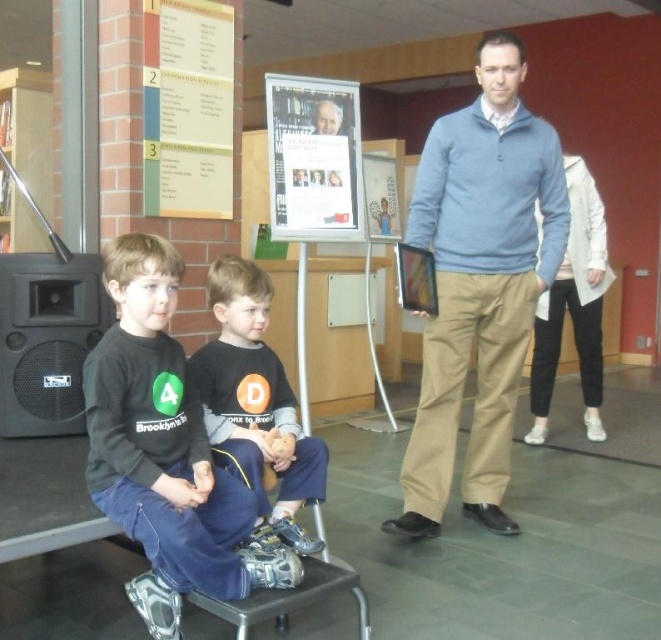
You are a delivery person who needs to place a package between the blue sweater at center and the black matte speaker at left. The package requires a space of 4 feet. Can you fit the package between them?

The blue sweater at center and the black matte speaker at left are 4.15 feet apart, so yes, the package requiring 4 feet of space can fit between them since the distance is sufficient.

You are a delivery person who needs to place a package between the black cotton shirt at center and the black matte speaker at left. The package is 20 inches long. Can you fit it between them?

The distance between the black cotton shirt at center and the black matte speaker at left is 22.74 inches. Since the package is 20 inches long, it can fit between them as there is enough space.

You are a photographer setting up for a group photo. You need to ensure that the black matte speaker at left and the smooth skin face at upper center are both in frame. Given that the camera has a fixed focal length, which object should you position closer to the camera to ensure both fit within the frame?

The black matte speaker at left is wider than the smooth skin face at upper center. To ensure both fit in the frame, position the black matte speaker at left closer to the camera since wider objects require more space in the frame when focused at the same distance.